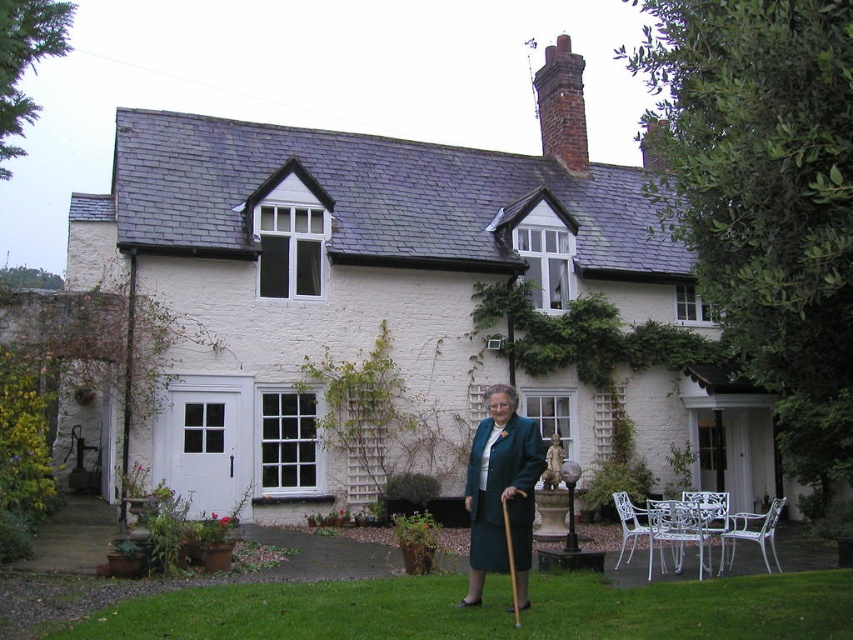
You are standing at the entrance of the house and want to walk directly towards the green grass at lower center. What coordinates should you aim for to reach it?

You should aim for the coordinates point (488,611) to reach the green grass at lower center.

You are a landscape architect designing a garden for the white painted brick cottage at center and the green grass at lower center. Which object is wider?

The white painted brick cottage at center is wider than the green grass at lower center.

You are standing at the garden entrance and want to walk towards the house. Which object will you step on first, the green grass at lower center or the teal fabric coat at center?

The green grass at lower center is in front of the teal fabric coat at center, so you will step on the green grass at lower center first.